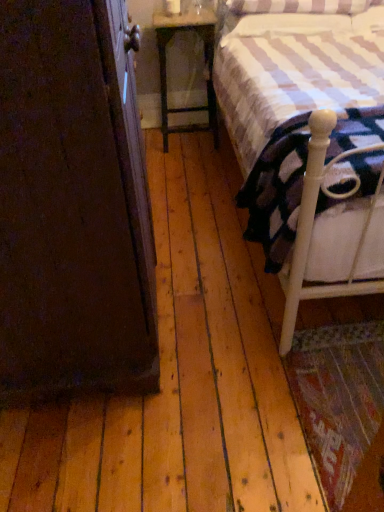
Question: Should I look upward or downward to see white wood bed at right?

Choices:
 (A) up
 (B) down

Answer: (A)

Question: Does white soft mattress at right lie in front of wooden nightstand at center?

Choices:
 (A) yes
 (B) no

Answer: (A)

Question: Is white soft mattress at right completely or partially outside of wooden nightstand at center?

Choices:
 (A) no
 (B) yes

Answer: (B)

Question: Is white soft mattress at right oriented towards wooden nightstand at center?

Choices:
 (A) no
 (B) yes

Answer: (A)

Question: Can you confirm if white soft mattress at right is shorter than wooden nightstand at center?

Choices:
 (A) no
 (B) yes

Answer: (B)

Question: From a real-world perspective, is white soft mattress at right physically above wooden nightstand at center?

Choices:
 (A) yes
 (B) no

Answer: (A)

Question: Are white soft mattress at right and wooden nightstand at center located far from each other?

Choices:
 (A) yes
 (B) no

Answer: (A)

Question: Is dark wood armoire at left shorter than white soft mattress at right?

Choices:
 (A) yes
 (B) no

Answer: (B)

Question: Does dark wood armoire at left turn towards white soft mattress at right?

Choices:
 (A) no
 (B) yes

Answer: (B)

Question: Considering the relative sizes of dark wood armoire at left and white soft mattress at right in the image provided, is dark wood armoire at left taller than white soft mattress at right?

Choices:
 (A) yes
 (B) no

Answer: (A)

Question: Is dark wood armoire at left bigger than white soft mattress at right?

Choices:
 (A) yes
 (B) no

Answer: (A)

Question: Are dark wood armoire at left and white soft mattress at right beside each other?

Choices:
 (A) yes
 (B) no

Answer: (B)

Question: Can you confirm if dark wood armoire at left is wider than white soft mattress at right?

Choices:
 (A) yes
 (B) no

Answer: (A)

Question: Is white wood bed at right to the left of wooden nightstand at center from the viewer's perspective?

Choices:
 (A) no
 (B) yes

Answer: (A)